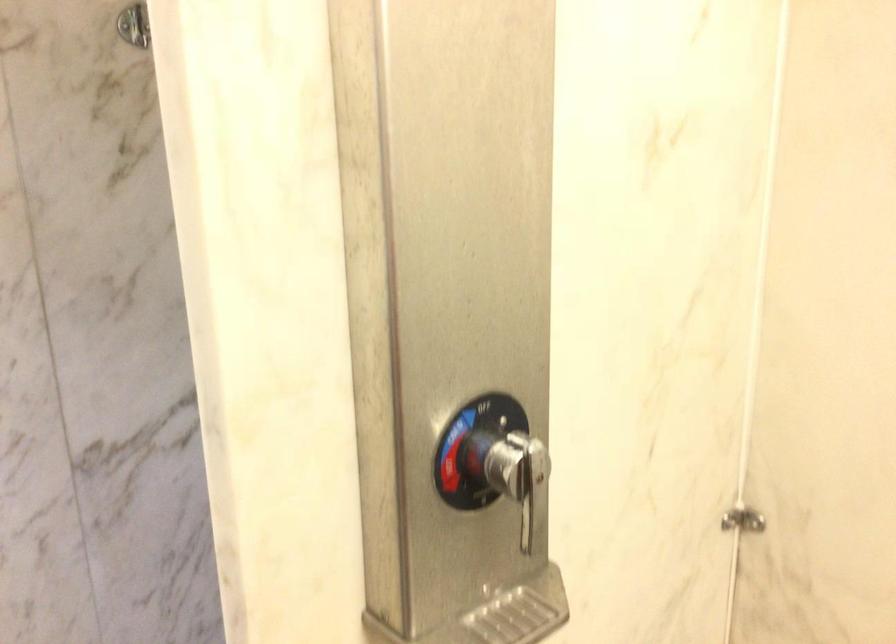
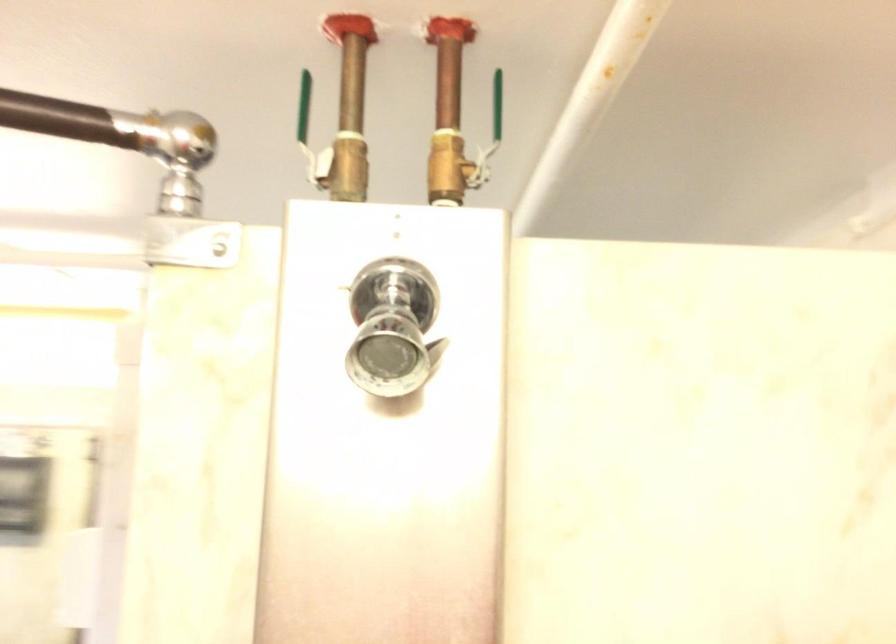
The images are taken continuously from a first-person perspective. In which direction is your viewpoint rotating?

The camera rotated toward left-up.